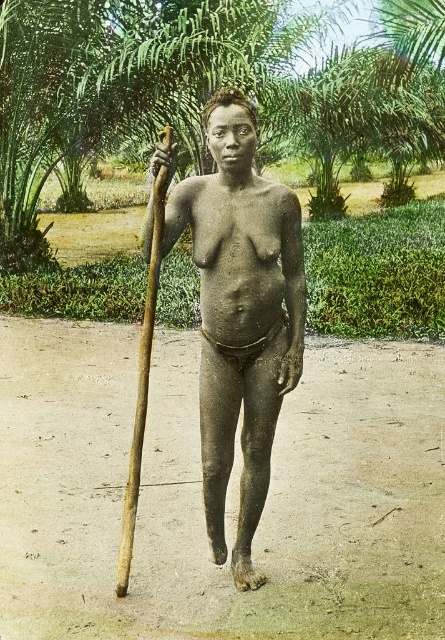
Question: Does brown wooden stick at center have a lesser width compared to brown wooden spear at left?

Choices:
 (A) no
 (B) yes

Answer: (A)

Question: Does brown wooden stick at center appear on the right side of brown wooden spear at left?

Choices:
 (A) yes
 (B) no

Answer: (A)

Question: Is brown wooden stick at center positioned at the back of brown wooden spear at left?

Choices:
 (A) no
 (B) yes

Answer: (A)

Question: Which of the following is the closest to the observer?

Choices:
 (A) click(241, 310)
 (B) click(117, 586)

Answer: (A)

Question: Which point is farther to the camera?

Choices:
 (A) (261, 472)
 (B) (168, 176)

Answer: (A)